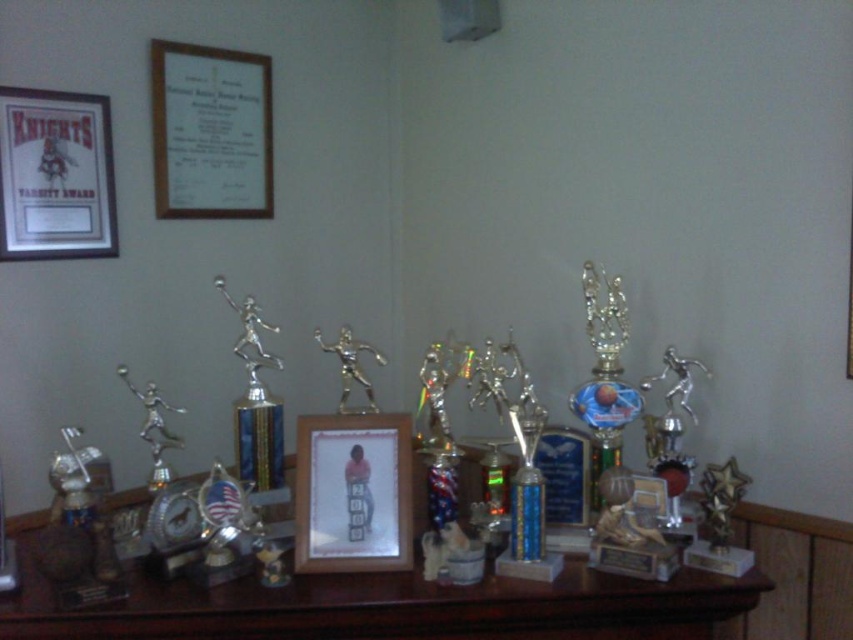
Is matte black frame at upper left wider than silver metallic figure at center?

In fact, matte black frame at upper left might be narrower than silver metallic figure at center.

At what (x,y) coordinates should I click in order to perform the action: click on matte black frame at upper left. Please return your answer as a coordinate pair (x, y). Looking at the image, I should click on click(x=55, y=176).

Can you confirm if matte black frame at upper left is wider than gold shiny basketball trophy at center?

Correct, the width of matte black frame at upper left exceeds that of gold shiny basketball trophy at center.

What do you see at coordinates (55, 176) in the screenshot? I see `matte black frame at upper left` at bounding box center [55, 176].

Which is behind, point (83, 154) or point (621, 304)?

Positioned behind is point (83, 154).

In order to click on matte black frame at upper left in this screenshot , I will do `click(55, 176)`.

Which is above, wooden table at center or wooden photo frame at center?

wooden photo frame at center

Between point (392, 586) and point (349, 426), which one is positioned behind?

The point (349, 426) is more distant.

Locate an element on the screen. The image size is (853, 640). wooden table at center is located at coordinates 383,605.